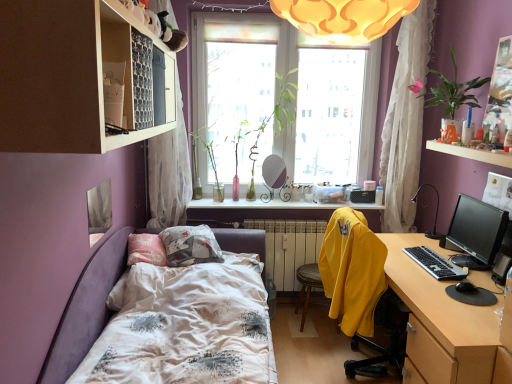
This screenshot has height=384, width=512. What do you see at coordinates (237, 152) in the screenshot?
I see `pink glass vase at window, arranged as the third plant when viewed from the right` at bounding box center [237, 152].

The height and width of the screenshot is (384, 512). I want to click on white sheer curtain at left, placed as the 2th curtain when sorted from right to left, so click(x=169, y=173).

What is the approximate width of white cotton bed at center?

white cotton bed at center is 4.42 feet in width.

The height and width of the screenshot is (384, 512). Describe the element at coordinates (405, 121) in the screenshot. I see `white sheer curtain at upper right, which is counted as the 2th curtain, starting from the left` at that location.

Find the location of `yellow fabric chair at center`. yellow fabric chair at center is located at coordinates (352, 271).

Where is `plant above the white sheer curtain at left, placed as the 2th curtain when sorted from right to left (from a real-world perspective)`? This screenshot has width=512, height=384. plant above the white sheer curtain at left, placed as the 2th curtain when sorted from right to left (from a real-world perspective) is located at coordinates (453, 91).

Does white sheer curtain at left, placed as the 2th curtain when sorted from right to left, have a smaller size compared to green leafy plant at upper right, the 4th plant from the left?

Incorrect, white sheer curtain at left, placed as the 2th curtain when sorted from right to left, is not smaller in size than green leafy plant at upper right, the 4th plant from the left.

Are white sheer curtain at left, placed as the 2th curtain when sorted from right to left, and green leafy plant at upper right, the 1th plant from the right, located far from each other?

Yes, white sheer curtain at left, placed as the 2th curtain when sorted from right to left, and green leafy plant at upper right, the 1th plant from the right, are located far from each other.

Based on their positions, is white sheer curtain at left, placed as the 1th curtain when sorted from left to right, located to the left or right of green leafy plant at upper right, the 1th plant from the right?

From the image, it's evident that white sheer curtain at left, placed as the 1th curtain when sorted from left to right, is to the left of green leafy plant at upper right, the 1th plant from the right.

How much distance is there between green glass vase at center, the fourth plant positioned from the right, and translucent glass vase at upper center, which ranks as the second window sill in left-to-right order?

green glass vase at center, the fourth plant positioned from the right, is 1.78 meters away from translucent glass vase at upper center, which ranks as the second window sill in left-to-right order.

Is green glass vase at center, the first plant viewed from the left, spatially inside translucent glass vase at upper center, which is the 2th window sill from bottom to top, or outside of it?

The correct answer is: outside.

Does point (215, 167) come farther from viewer compared to point (495, 159)?

Yes, it is behind point (495, 159).

Is green glass vase at center, the first plant viewed from the left, not near translucent glass vase at upper center, the first window sill from the top?

green glass vase at center, the first plant viewed from the left, is positioned a significant distance from translucent glass vase at upper center, the first window sill from the top.

Looking at this image, from the image's perspective, relative to yellow fabric chair at center, is translucent glass vase at upper center, positioned as the first window sill in front-to-back order, above or below?

translucent glass vase at upper center, positioned as the first window sill in front-to-back order, is above yellow fabric chair at center.

In terms of height, does translucent glass vase at upper center, which is the 2th window sill from bottom to top, look taller or shorter compared to yellow fabric chair at center?

translucent glass vase at upper center, which is the 2th window sill from bottom to top, is shorter than yellow fabric chair at center.

From a real-world perspective, between translucent glass vase at upper center, which is the first window sill in right-to-left order, and yellow fabric chair at center, who is vertically higher?

From a 3D spatial view, translucent glass vase at upper center, which is the first window sill in right-to-left order, is above.

Is white sheer curtain at left, placed as the 1th curtain when sorted from left to right, closer to camera compared to wooden desk at right?

No, it is not.

Considering the relative sizes of white sheer curtain at left, placed as the 1th curtain when sorted from left to right, and wooden desk at right in the image provided, is white sheer curtain at left, placed as the 1th curtain when sorted from left to right, smaller than wooden desk at right?

Yes.

Is white sheer curtain at left, placed as the 1th curtain when sorted from left to right, positioned with its back to wooden desk at right?

No, white sheer curtain at left, placed as the 1th curtain when sorted from left to right, is not facing the opposite direction of wooden desk at right.

Identify the location of desk that is in front of the white sheer curtain at left, placed as the 1th curtain when sorted from left to right. Image resolution: width=512 pixels, height=384 pixels. (441, 320).

Consider the image. Does white sheer curtain at upper right, the first curtain from the right, have a larger size compared to green glossy plant at center, the 2th plant positioned from the right?

Incorrect, white sheer curtain at upper right, the first curtain from the right, is not larger than green glossy plant at center, the 2th plant positioned from the right.

Considering the sizes of objects white sheer curtain at upper right, the first curtain from the right, and green glossy plant at center, the 2th plant positioned from the right, in the image provided, who is thinner, white sheer curtain at upper right, the first curtain from the right, or green glossy plant at center, the 2th plant positioned from the right,?

Thinner between the two is white sheer curtain at upper right, the first curtain from the right.

Is white sheer curtain at upper right, which is counted as the 2th curtain, starting from the left, facing towards green glossy plant at center, acting as the third plant starting from the left?

No, white sheer curtain at upper right, which is counted as the 2th curtain, starting from the left, is not turned towards green glossy plant at center, acting as the third plant starting from the left.

Is white sheer curtain at upper right, the first curtain from the right, surrounding green glossy plant at center, acting as the third plant starting from the left?

No, green glossy plant at center, acting as the third plant starting from the left, is located outside of white sheer curtain at upper right, the first curtain from the right.

From a real-world perspective, is green leafy plant at upper right, the 4th plant from the left, below pink glass vase at window, which is the 2th plant in left-to-right order?

→ No, from a real-world perspective, green leafy plant at upper right, the 4th plant from the left, is not below pink glass vase at window, which is the 2th plant in left-to-right order.

From the image's perspective, who appears lower, green leafy plant at upper right, the 1th plant from the right, or pink glass vase at window, arranged as the third plant when viewed from the right?

pink glass vase at window, arranged as the third plant when viewed from the right.

Looking at this image, can you confirm if green leafy plant at upper right, the 1th plant from the right, is bigger than pink glass vase at window, which is the 2th plant in left-to-right order?

Yes.

Measure the distance between green leafy plant at upper right, the 4th plant from the left, and pink glass vase at window, which is the 2th plant in left-to-right order.

green leafy plant at upper right, the 4th plant from the left, and pink glass vase at window, which is the 2th plant in left-to-right order, are 1.49 meters apart.

Is green leafy plant at upper right, the 4th plant from the left, positioned with its back to yellow fabric at lower right?

No, green leafy plant at upper right, the 4th plant from the left, is not facing the opposite direction of yellow fabric at lower right.

Between green leafy plant at upper right, the 1th plant from the right, and yellow fabric at lower right, which one appears on the left side from the viewer's perspective?

yellow fabric at lower right.

Considering the positions of point (459, 100) and point (311, 275), is point (459, 100) closer or farther from the camera than point (311, 275)?

Point (459, 100).

The image size is (512, 384). In order to click on plant that is the 4th one when counting rightward from the white sheer curtain at left, placed as the 1th curtain when sorted from left to right in this screenshot , I will do `click(453, 91)`.

Where is `window sill above the green glass vase at center, the first plant viewed from the left (from the image's perspective)`? This screenshot has width=512, height=384. window sill above the green glass vase at center, the first plant viewed from the left (from the image's perspective) is located at coordinates (472, 153).

Estimate the real-world distances between objects in this image. Which object is closer to green leafy plant at upper right, the 1th plant from the right, white sheer curtain at upper right, which is counted as the 2th curtain, starting from the left, or white sheer curtain at left, placed as the 2th curtain when sorted from right to left?

Based on the image, white sheer curtain at upper right, which is counted as the 2th curtain, starting from the left, appears to be nearer to green leafy plant at upper right, the 1th plant from the right.

From the image, which object appears to be farther from clear glass bottles at center, placed as the first window sill when sorted from bottom to top, transparent glass window at center or black plastic keyboard at right?

black plastic keyboard at right is positioned further to the anchor clear glass bottles at center, placed as the first window sill when sorted from bottom to top.

When comparing their distances from black plastic table lamp at right, does white sheer curtain at upper right, which is counted as the 2th curtain, starting from the left, or yellow fabric at lower right seem closer?

The object closer to black plastic table lamp at right is white sheer curtain at upper right, which is counted as the 2th curtain, starting from the left.

Looking at the image, which one is located further to translucent glass vase at upper center, which is the 2th window sill from bottom to top, green glossy plant at center, acting as the third plant starting from the left, or transparent glass window at center?

Among the two, green glossy plant at center, acting as the third plant starting from the left, is located further to translucent glass vase at upper center, which is the 2th window sill from bottom to top.

Estimate the real-world distances between objects in this image. Which object is further from green glossy plant at center, acting as the third plant starting from the left, clear glass bottles at center, placed as the first window sill when sorted from bottom to top, or matte white shelf at upper left?

matte white shelf at upper left lies further to green glossy plant at center, acting as the third plant starting from the left, than the other object.

Looking at this image, which object lies nearer to the anchor point clear glass bottles at center, the 2th window sill positioned from the front, pink glass vase at window, arranged as the third plant when viewed from the right, or green leafy plant at upper right, the 4th plant from the left?

pink glass vase at window, arranged as the third plant when viewed from the right, is positioned closer to the anchor clear glass bottles at center, the 2th window sill positioned from the front.

Estimate the real-world distances between objects in this image. Which object is further from yellow fabric computer chair at right, white metallic radiator at center or white sheer curtain at upper right, the first curtain from the right?

white sheer curtain at upper right, the first curtain from the right, is positioned further to the anchor yellow fabric computer chair at right.

Which object lies nearer to the anchor point black plastic keyboard at right, black glossy monitor at right or white metallic radiator at center?

black glossy monitor at right is positioned closer to the anchor black plastic keyboard at right.

The width and height of the screenshot is (512, 384). I want to click on computer monitor between yellow fabric chair at center and clear glass bottles at center, which is counted as the 2th window sill, starting from the right, from front to back, so click(x=475, y=232).

At what (x,y) coordinates should I click in order to perform the action: click on computer between green glass vase at center, the fourth plant positioned from the right, and black plastic table lamp at right from left to right. Please return your answer as a coordinate pair (x, y). The width and height of the screenshot is (512, 384). Looking at the image, I should click on (307, 287).

This screenshot has height=384, width=512. I want to click on curtain located between white cotton bed at center and black plastic table lamp at right in the left-right direction, so click(x=405, y=121).

Locate an element on the screen. computer monitor between green glossy plant at center, acting as the third plant starting from the left, and yellow fabric at lower right from top to bottom is located at coordinates (475, 232).